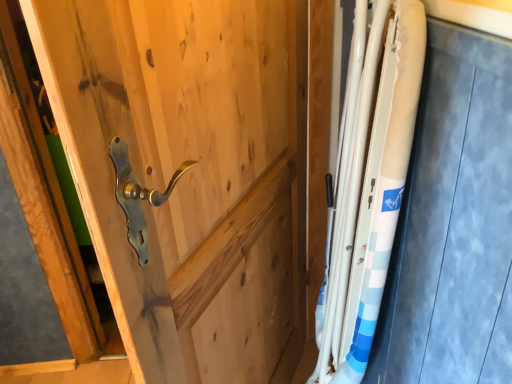
Question: Is natural wood door handle at center in front of or behind white glossy steel at right in the image?

Choices:
 (A) front
 (B) behind

Answer: (A)

Question: From a real-world perspective, is natural wood door handle at center physically located above or below white glossy steel at right?

Choices:
 (A) above
 (B) below

Answer: (B)

Question: Considering the relative positions of natural wood door handle at center and white glossy steel at right in the image provided, is natural wood door handle at center to the left or to the right of white glossy steel at right?

Choices:
 (A) right
 (B) left

Answer: (B)

Question: From a real-world perspective, relative to natural wood door handle at center, is white glossy steel at right vertically above or below?

Choices:
 (A) above
 (B) below

Answer: (A)

Question: Considering the positions of white glossy steel at right and natural wood door handle at center in the image, is white glossy steel at right wider or thinner than natural wood door handle at center?

Choices:
 (A) wide
 (B) thin

Answer: (A)

Question: From the image's perspective, is white glossy steel at right positioned above or below natural wood door handle at center?

Choices:
 (A) above
 (B) below

Answer: (A)

Question: Considering their positions, is white glossy steel at right located in front of or behind natural wood door handle at center?

Choices:
 (A) front
 (B) behind

Answer: (B)